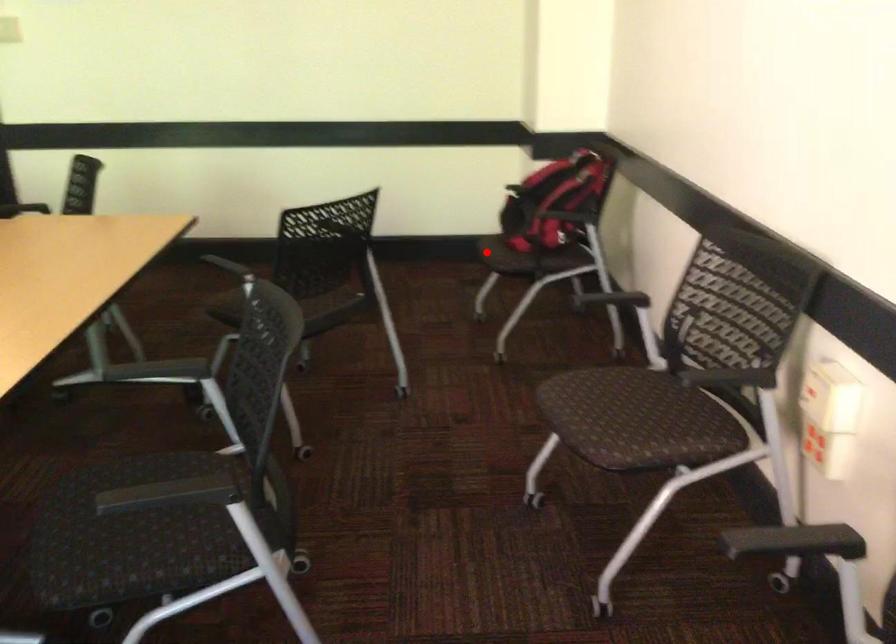
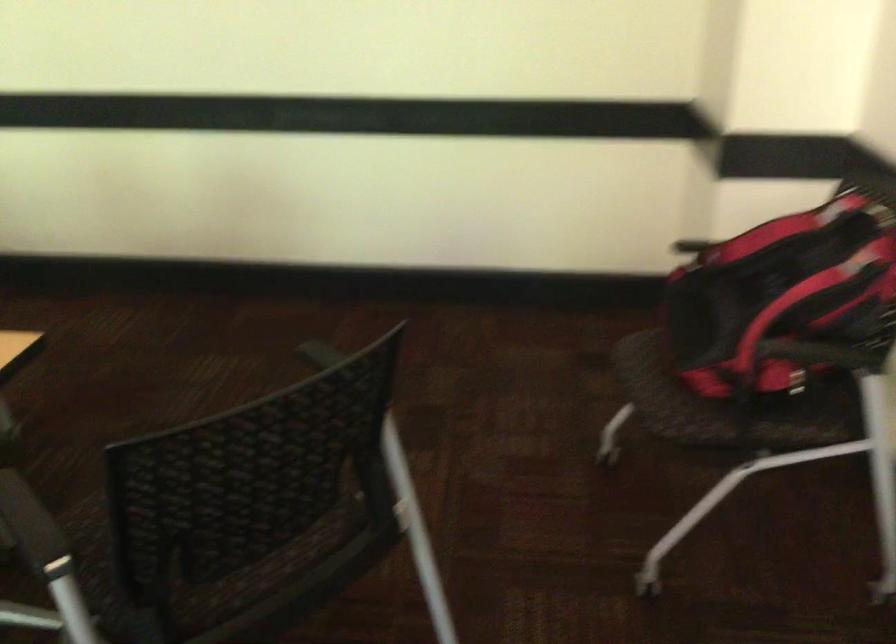
Question: I am providing you with two images of the same scene from different viewpoints. In image1, a red point is highlighted. Considering the same 3D point in image2, which of the following is correct?

Choices:
 (A) It is closer
 (B) It is farther

Answer: (A)